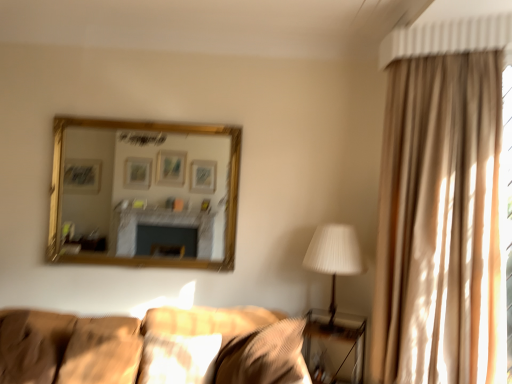
I want to click on free space above beige fabric curtain at right (from a real-world perspective), so click(453, 49).